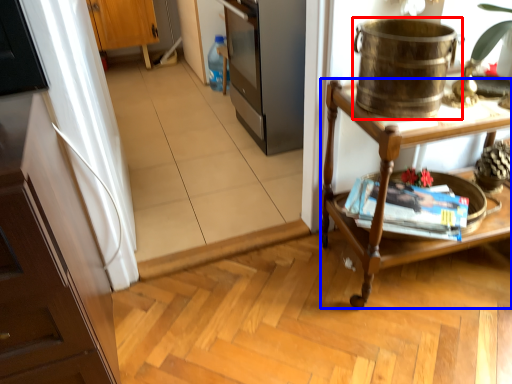
Question: Which object is further to the camera taking this photo, appliance (highlighted by a red box) or desk (highlighted by a blue box)?

Choices:
 (A) appliance
 (B) desk

Answer: (B)